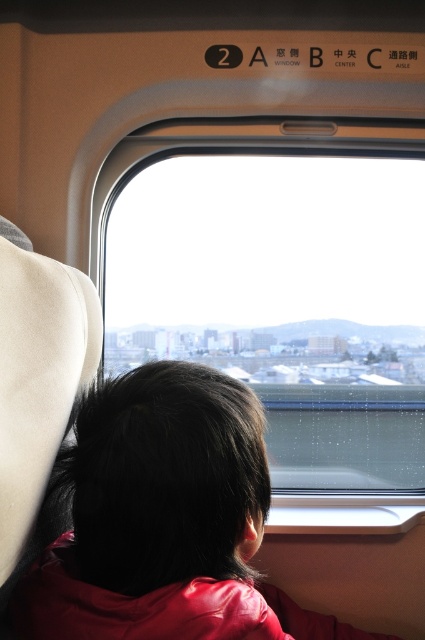
Question: Is transparent glass window at center bigger than red leather jacket at center?

Choices:
 (A) no
 (B) yes

Answer: (B)

Question: Is transparent glass window at center to the right of red leather jacket at center from the viewer's perspective?

Choices:
 (A) no
 (B) yes

Answer: (B)

Question: Is transparent glass window at center further to the viewer compared to red leather jacket at center?

Choices:
 (A) yes
 (B) no

Answer: (A)

Question: Which point is farther from the camera taking this photo?

Choices:
 (A) (263, 481)
 (B) (362, 176)

Answer: (B)

Question: Which of the following is the farthest from the observer?

Choices:
 (A) transparent glass window at center
 (B) red leather jacket at center

Answer: (A)

Question: Which point is farther to the camera?

Choices:
 (A) red leather jacket at center
 (B) transparent glass window at center

Answer: (B)